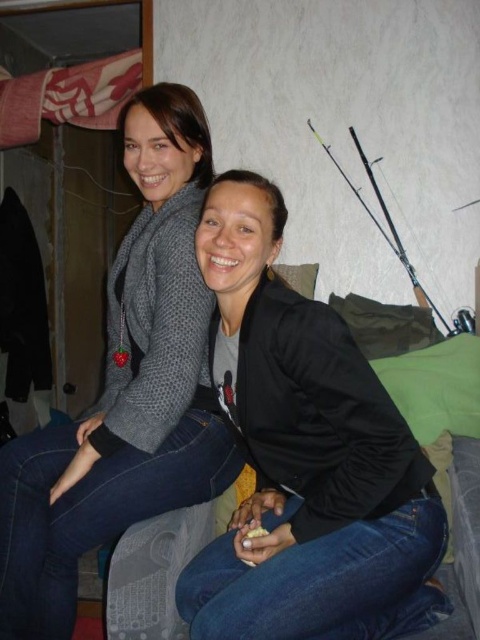
Who is taller, black matte jacket at center or knitted gray sweater at upper left?

Standing taller between the two is knitted gray sweater at upper left.

Describe the element at coordinates (302, 452) in the screenshot. The image size is (480, 640). I see `black matte jacket at center` at that location.

Measure the distance between point (x=340, y=417) and camera.

1.03 meters

Where is `black matte jacket at center`? The height and width of the screenshot is (640, 480). black matte jacket at center is located at coordinates (302, 452).